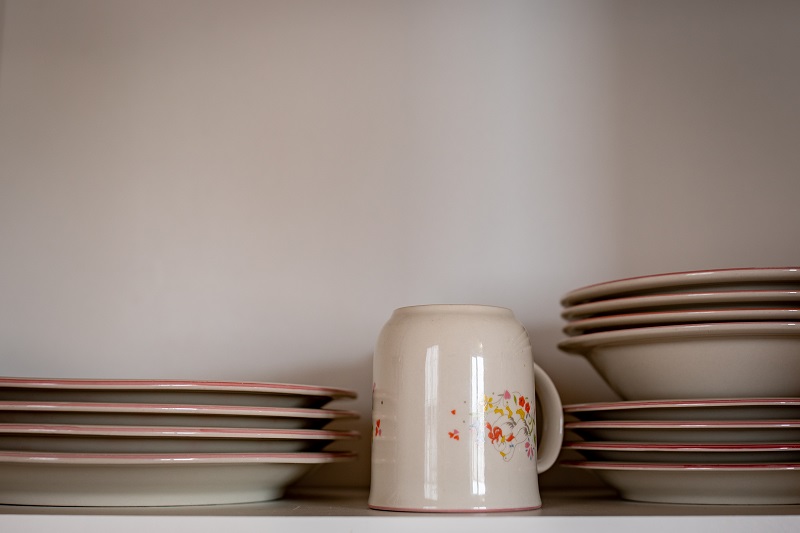
Locate an element on the screen. This screenshot has width=800, height=533. plates is located at coordinates (190, 479), (206, 440), (173, 418), (202, 391), (674, 481), (676, 455), (704, 433), (728, 411).